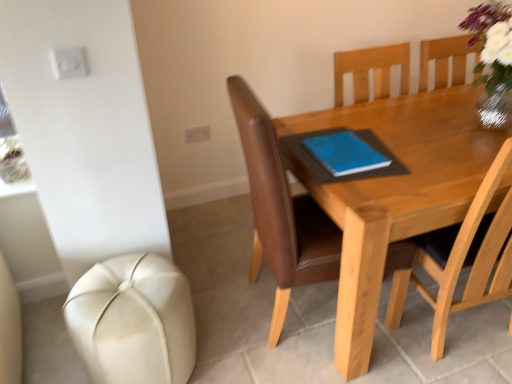
Image resolution: width=512 pixels, height=384 pixels. Identify the location of free location in front of blue matte notebook at center. (384, 195).